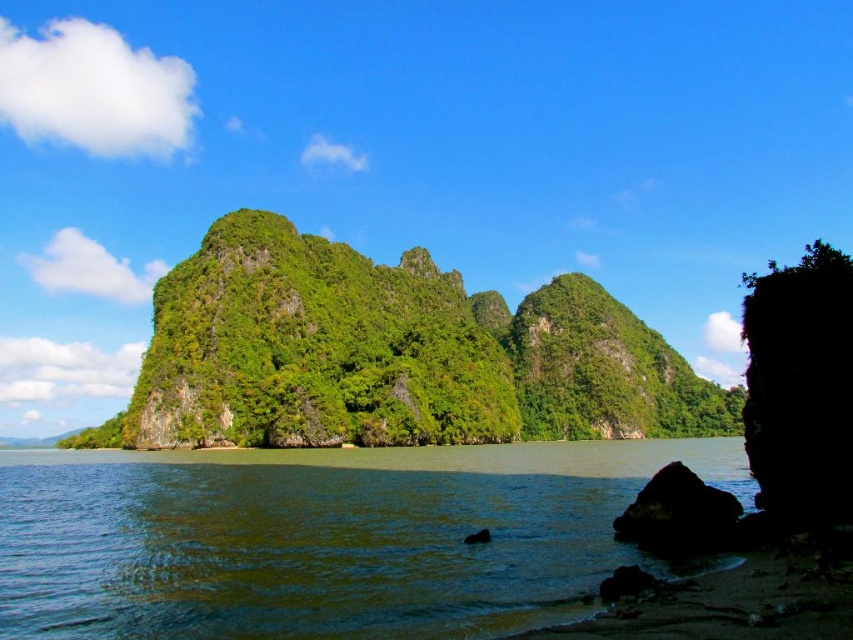
You are a kayaker planning to navigate through the coastal area shown in the image. You need to determine the safest route between the green water at lower left and the black rock at lower right. Based on the scene description, which direction should you head towards to avoid obstacles?

The green water at lower left is below the black rock at lower right, so heading towards the green water at lower left would be safer as it is positioned below the rock, likely indicating calmer waters away from potential obstacles.

You are standing on a boat in the middle of the water and see the point marked as point (323, 538). Is this point located in the lower left area of the image?

Yes, the point (323, 538) corresponds to the green water at lower left, so it is located in the lower left area of the image.